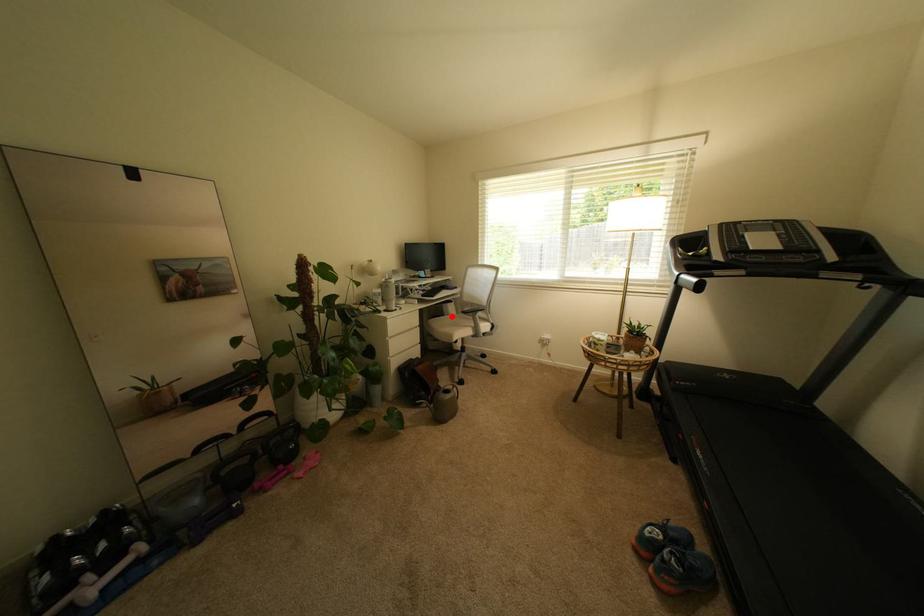
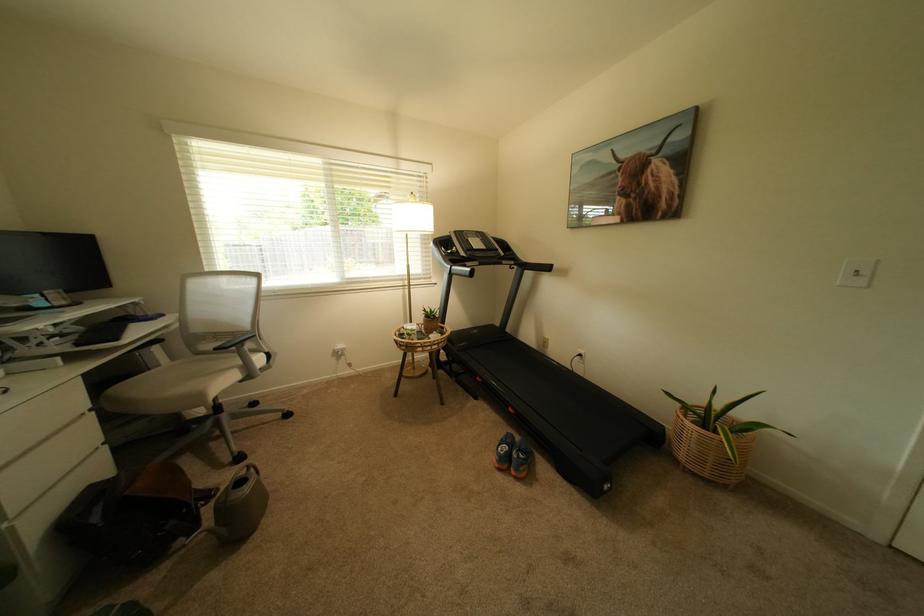
The point at the highlighted location is marked in the first image. Where is the corresponding point in the second image?

(157, 370)